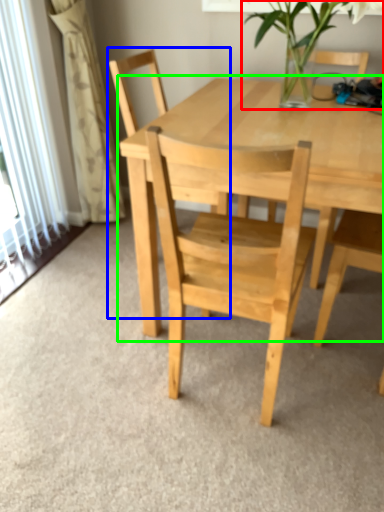
Question: Estimate the real-world distances between objects in this image. Which object is farther from houseplant (highlighted by a red box), chair (highlighted by a blue box) or round table (highlighted by a green box)?

Choices:
 (A) chair
 (B) round table

Answer: (A)